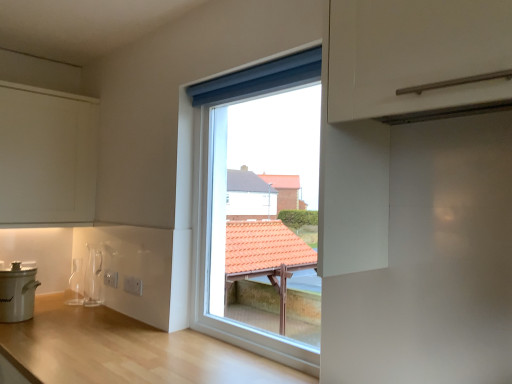
Locate an element on the screen. The width and height of the screenshot is (512, 384). vacant area located to the right-hand side of white matte cooker at lower left is located at coordinates (51, 317).